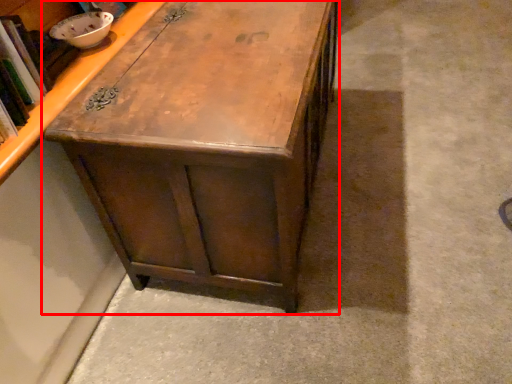
Question: From the image's perspective, what is the correct spatial positioning of table (annotated by the red box) in reference to cabinetry?

Choices:
 (A) below
 (B) above

Answer: (B)